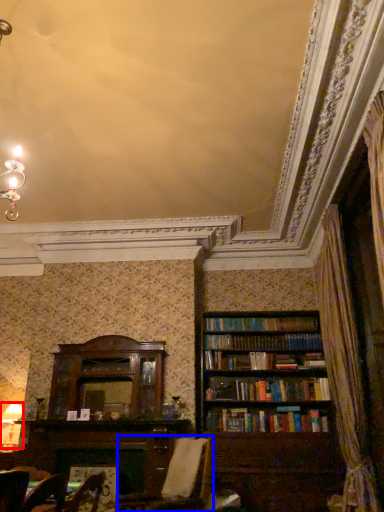
Question: Which object appears farthest to the camera in this image, lamp (highlighted by a red box) or swivel chair (highlighted by a blue box)?

Choices:
 (A) lamp
 (B) swivel chair

Answer: (A)